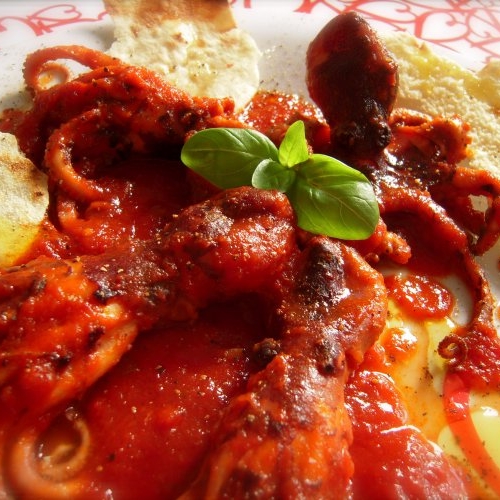
What are the coordinates of `plate` in the screenshot? It's located at (458, 32).